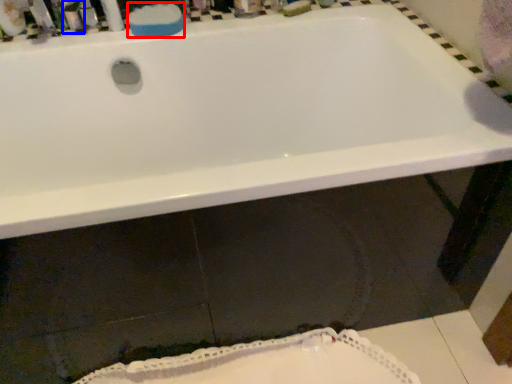
Question: Which point is closer to the camera, soap (highlighted by a red box) or toiletry (highlighted by a blue box)?

Choices:
 (A) soap
 (B) toiletry

Answer: (B)